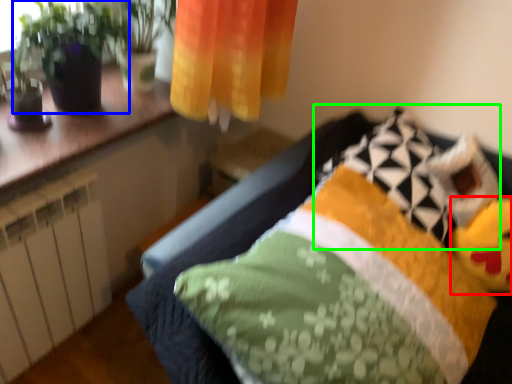
Question: Based on their relative distances, which object is nearer to toy (highlighted by a red box)? Choose from houseplant (highlighted by a blue box) and pillow (highlighted by a green box).

Choices:
 (A) houseplant
 (B) pillow

Answer: (B)